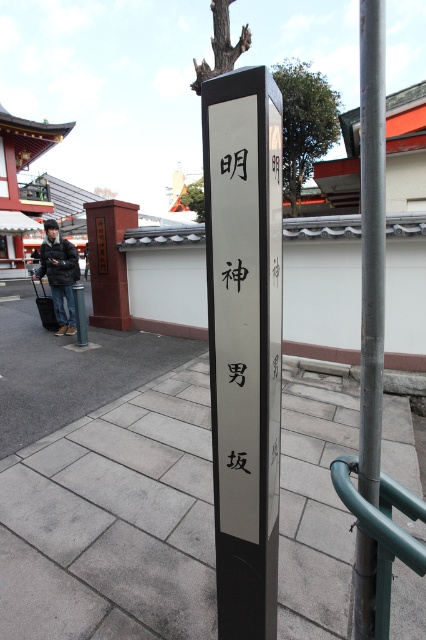
Between white glossy signpost at center and metallic gray pole at center right, which one has more height?

Standing taller between the two is white glossy signpost at center.

Is the position of white glossy signpost at center less distant than that of metallic gray pole at center right?

No, it is behind metallic gray pole at center right.

Which is behind, point (273, 401) or point (374, 273)?

The point (273, 401) is behind.

This screenshot has height=640, width=426. Find the location of `white glossy signpost at center`. white glossy signpost at center is located at coordinates (244, 340).

Is point (359, 547) positioned before point (114, 276)?

That is True.

Does metallic gray pole at center right appear under brick signpost at center?

Yes, metallic gray pole at center right is below brick signpost at center.

Identify the location of metallic gray pole at center right. (371, 243).

Find the location of `metallic gray pole at center right`. metallic gray pole at center right is located at coordinates (371, 243).

Is metallic gray pole at center right above matte black signpost at lower left?

No.

Does metallic gray pole at center right lie behind matte black signpost at lower left?

No, metallic gray pole at center right is closer to the viewer.

Identify the location of metallic gray pole at center right. The height and width of the screenshot is (640, 426). (371, 243).